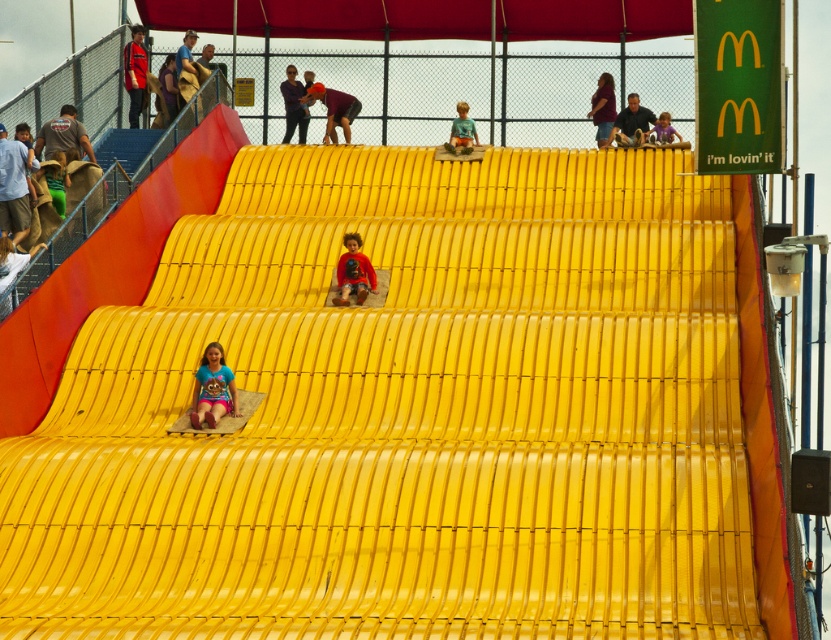
You are a parent standing at the base of the slide and want to ensure the safety of your children. You see the red shirt at upper left and the dark gray shirt at upper center. Which child is closer to you?

The red shirt at upper left is closer to you because it is further to the viewer than the dark gray shirt at upper center, meaning it is positioned nearer to your location at the base of the slide.

You are standing at the base of the slide and want to take a photo of the point at coordinates (x=347, y=232). If the camera you are using has a maximum focus range of 250 feet, will you be able to capture the point clearly?

The distance of point (x=347, y=232) from the camera is 251.93 feet, which exceeds the camera maximum focus range of 250 feet. Therefore, the point will not be captured clearly.